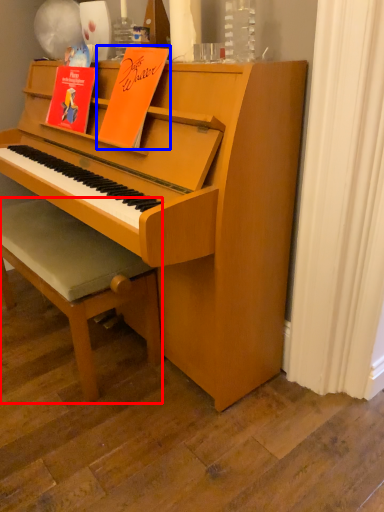
Question: Which object is closer to the camera taking this photo, footrest (highlighted by a red box) or paperback book (highlighted by a blue box)?

Choices:
 (A) footrest
 (B) paperback book

Answer: (B)